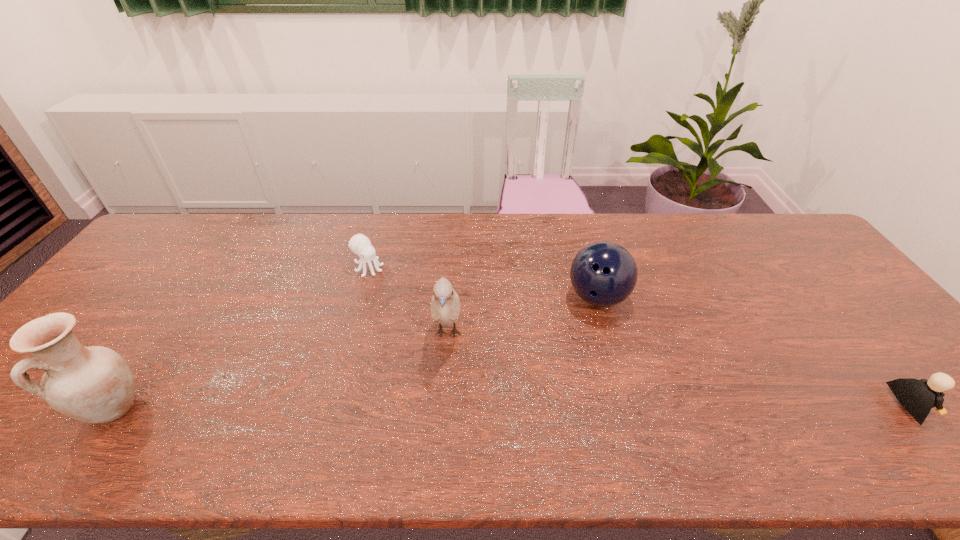
Find the location of a particular element. The image size is (960, 540). free spot between the fourth object from right to left and the leftmost object is located at coordinates (241, 338).

The image size is (960, 540). In order to click on blank region between the leftmost object and the fourth object from left to right in this screenshot , I will do `click(355, 352)`.

Locate an element on the screen. vacant area between the octopus and the bowling ball is located at coordinates 483,282.

Choose which object is the second nearest neighbor to the leftmost object. Please provide its 2D coordinates. Your answer should be formatted as a tuple, i.e. [(x, y)], where the tuple contains the x and y coordinates of a point satisfying the conditions above.

[(445, 305)]

Identify which object is the fourth nearest to the Lego. Please provide its 2D coordinates. Your answer should be formatted as a tuple, i.e. [(x, y)], where the tuple contains the x and y coordinates of a point satisfying the conditions above.

[(94, 384)]

The image size is (960, 540). What are the coordinates of `vacant region that satisfies the following two spatial constraints: 1. on the front side of the Lego; 2. on the front-facing side of the bird` in the screenshot? It's located at (443, 406).

I want to click on vacant space that satisfies the following two spatial constraints: 1. on the back side of the third object from right to left; 2. on the left side of the fourth object from left to right, so click(450, 298).